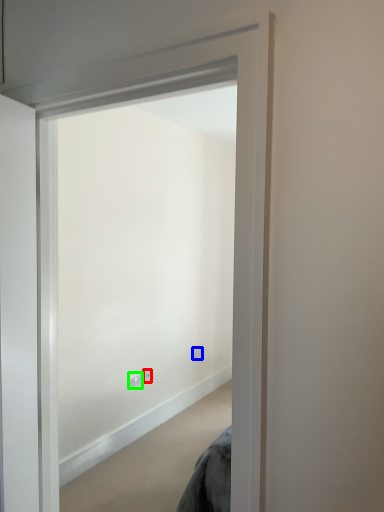
Question: Considering the real-world distances, which object is closest to electric outlet (highlighted by a red box)? electric outlet (highlighted by a blue box) or electric outlet (highlighted by a green box).

Choices:
 (A) electric outlet
 (B) electric outlet

Answer: (B)